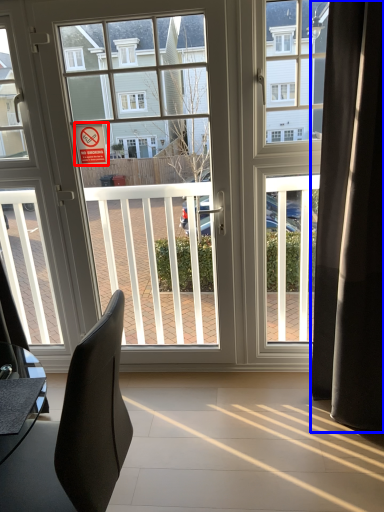
Question: Which point is closer to the camera, parking sign (highlighted by a red box) or curtain (highlighted by a blue box)?

Choices:
 (A) parking sign
 (B) curtain

Answer: (B)